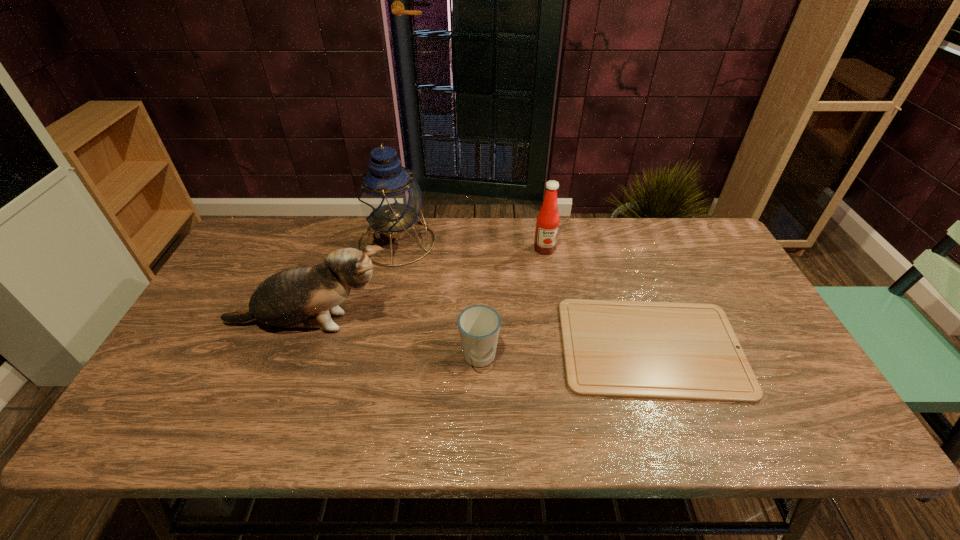
Find the location of a particular element. The width and height of the screenshot is (960, 540). the tallest object is located at coordinates (389, 198).

Locate an element on the screen. The height and width of the screenshot is (540, 960). cat is located at coordinates (287, 299).

Where is `condiment`? The height and width of the screenshot is (540, 960). condiment is located at coordinates (547, 225).

You are a GUI agent. You are given a task and a screenshot of the screen. Output one action in this format:
    pyautogui.click(x=<x>, y=<y>)
    Task: Click on the fourth tallest object
    
    Given the screenshot: What is the action you would take?
    pyautogui.click(x=479, y=325)

Identify the location of cup. (479, 325).

Find the location of a particular element. the shortest object is located at coordinates (634, 349).

The image size is (960, 540). Identify the location of blank space located 0.130m on the front-facing side of the tallest object. (474, 242).

Locate an element on the screen. The image size is (960, 540). vacant space situated 0.200m at the face of the cat is located at coordinates (468, 324).

Identify the location of vacant region located 0.330m on the front-facing side of the condiment. Image resolution: width=960 pixels, height=540 pixels. (560, 337).

Where is `free spot located 0.060m with a handle on the side of the third object from right to left`? The width and height of the screenshot is (960, 540). free spot located 0.060m with a handle on the side of the third object from right to left is located at coordinates (479, 400).